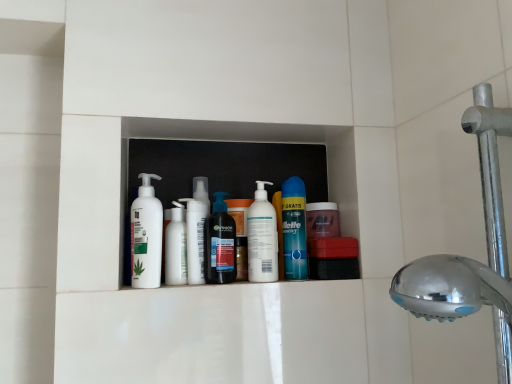
Question: Considering the positions of blue glossy can at center, marked as the 1th cleaning product in a right-to-left arrangement, and translucent plastic bottle at center, marked as the 3th cleaning product in a left-to-right arrangement, in the image, is blue glossy can at center, marked as the 1th cleaning product in a right-to-left arrangement, taller or shorter than translucent plastic bottle at center, marked as the 3th cleaning product in a left-to-right arrangement,?

Choices:
 (A) tall
 (B) short

Answer: (A)

Question: Is blue glossy can at center, marked as the 1th cleaning product in a right-to-left arrangement, wider or thinner than translucent plastic bottle at center, which is the 3th cleaning product in right-to-left order?

Choices:
 (A) thin
 (B) wide

Answer: (B)

Question: Estimate the real-world distances between objects in this image. Which object is farther from the chrome metallic shower head at right?

Choices:
 (A) white glossy lotion at center
 (B) white matte pump bottle at center, acting as the 4th cleaning product starting from the left
 (C) white matte bottle at center, positioned as the 2th cleaning product in left-to-right order
 (D) translucent plastic bottle at center, marked as the 3th cleaning product in a left-to-right arrangement
 (E) blue glossy can at center, which ranks as the fifth cleaning product in left-to-right order

Answer: (A)

Question: Estimate the real-world distances between objects in this image. Which object is farther from the white matte lotion at center, acting as the 5th cleaning product starting from the right?

Choices:
 (A) blue glossy can at center, marked as the 1th cleaning product in a right-to-left arrangement
 (B) chrome metallic shower head at right
 (C) white matte pump bottle at center, which is counted as the 2th cleaning product, starting from the right
 (D) white glossy lotion at center
 (E) white matte bottle at center, positioned as the 2th cleaning product in left-to-right order

Answer: (B)